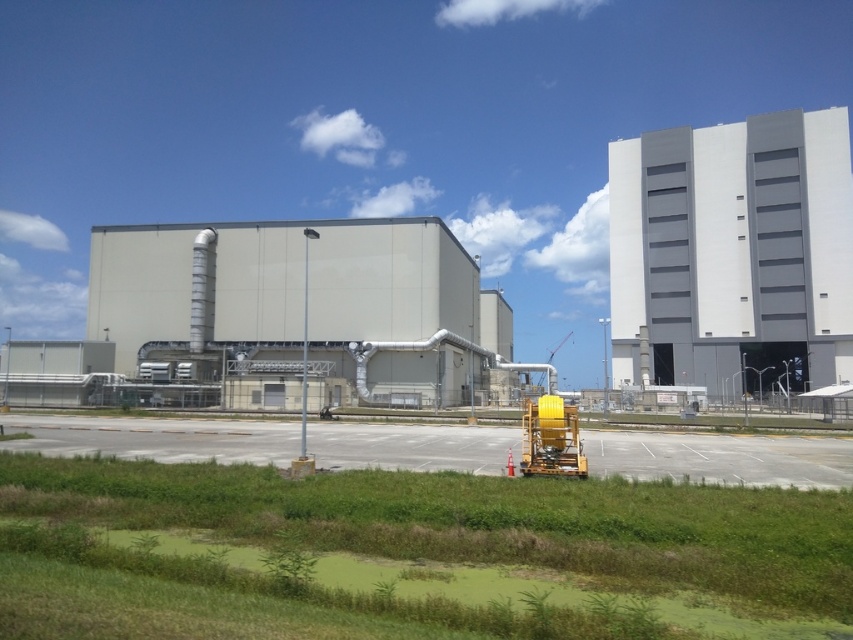
Question: Among these objects, which one is farthest from the camera?

Choices:
 (A) gray concrete factory at center
 (B) gray concrete building at upper right

Answer: (B)

Question: Is gray concrete factory at center to the right of gray concrete building at upper right from the viewer's perspective?

Choices:
 (A) no
 (B) yes

Answer: (A)

Question: Which point is farther to the camera?

Choices:
 (A) gray concrete factory at center
 (B) gray concrete building at upper right

Answer: (B)

Question: From the image, what is the correct spatial relationship of gray concrete factory at center in relation to gray concrete building at upper right?

Choices:
 (A) below
 (B) above

Answer: (A)

Question: Does gray concrete factory at center appear under gray concrete building at upper right?

Choices:
 (A) no
 (B) yes

Answer: (B)

Question: Among these points, which one is farthest from the camera?

Choices:
 (A) (728, 300)
 (B) (318, 284)

Answer: (A)